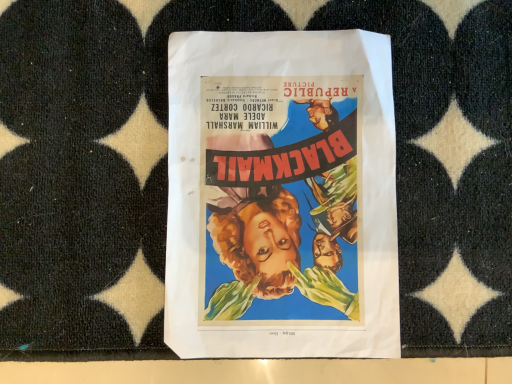
The height and width of the screenshot is (384, 512). What do you see at coordinates (281, 196) in the screenshot?
I see `vibrant paper poster at center` at bounding box center [281, 196].

Locate an element on the screen. vibrant paper poster at center is located at coordinates (281, 196).

This screenshot has height=384, width=512. Find the location of `vibrant paper poster at center`. vibrant paper poster at center is located at coordinates (281, 196).